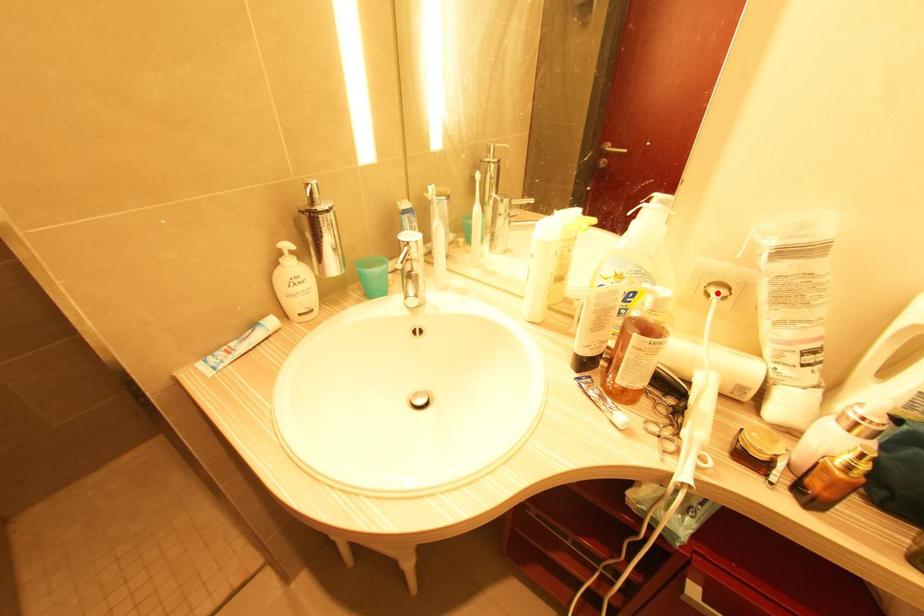
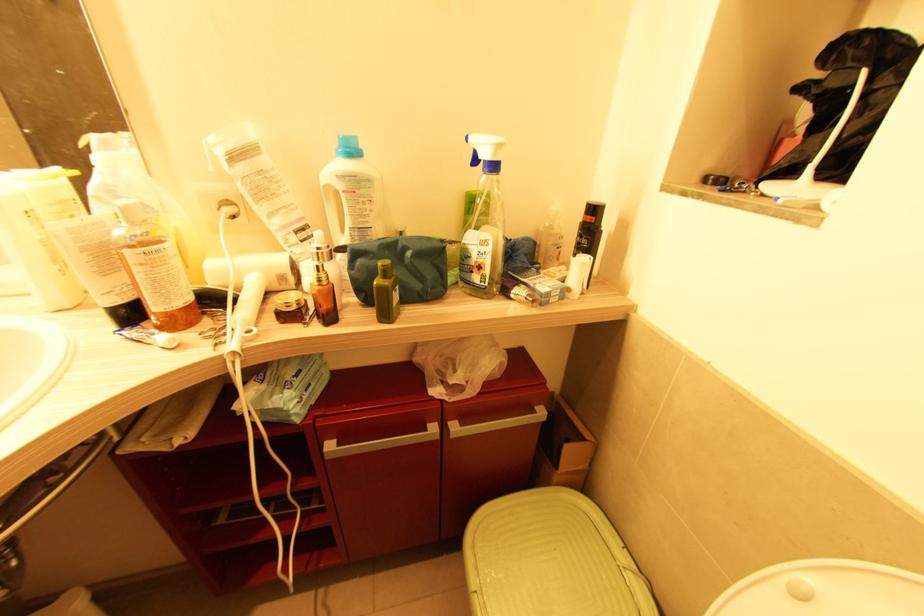
The point at the highlighted location is marked in the first image. Where is the corresponding point in the second image?

(229, 211)